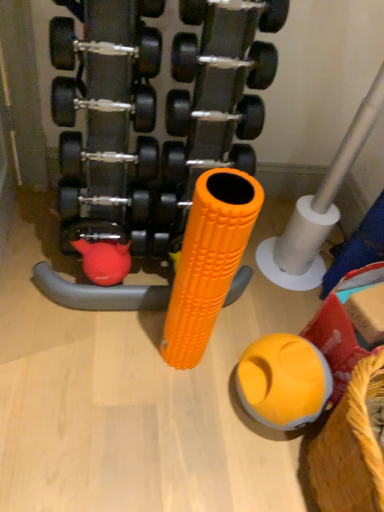
Question: From a real-world perspective, is yellow woven basket at lower right above or below silver metallic pipe at center right?

Choices:
 (A) below
 (B) above

Answer: (A)

Question: Is yellow woven basket at lower right to the left or to the right of silver metallic pipe at center right in the image?

Choices:
 (A) left
 (B) right

Answer: (B)

Question: Estimate the real-world distances between objects in this image. Which object is farther from the silver metallic pipe at center right?

Choices:
 (A) rubberized yellow ball at lower right
 (B) black rubber dumbbell at center
 (C) yellow woven basket at lower right

Answer: (C)

Question: Estimate the real-world distances between objects in this image. Which object is farther from the silver metallic pipe at center right?

Choices:
 (A) black rubber dumbbell at center
 (B) rubberized yellow ball at lower right
 (C) yellow woven basket at lower right

Answer: (C)